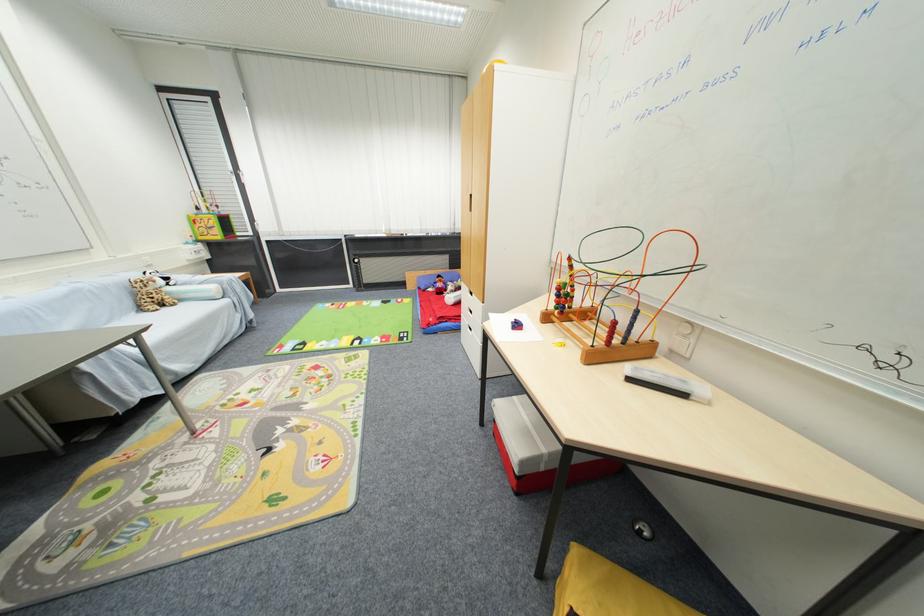
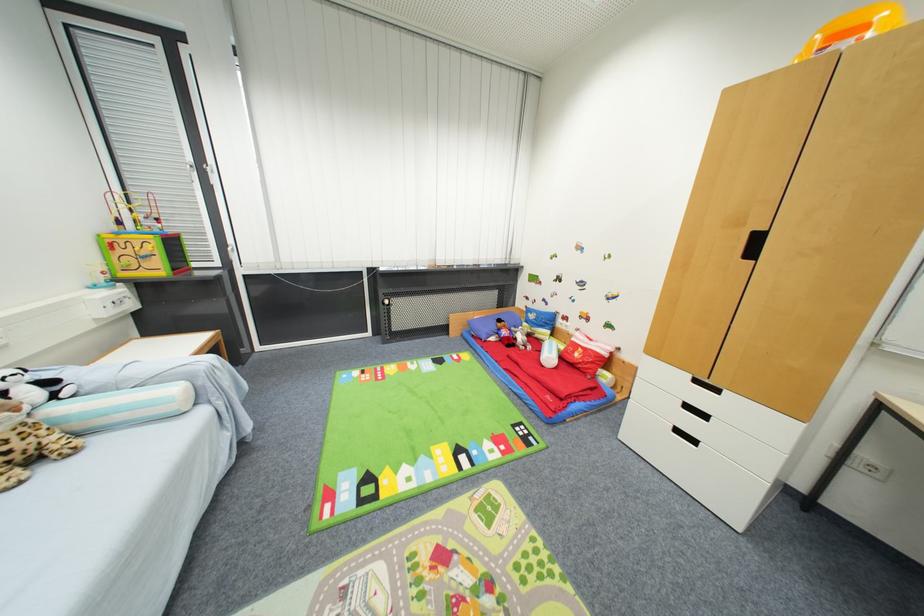
Where in the second image is the point corresponding to [424,281] from the first image?

(475, 325)